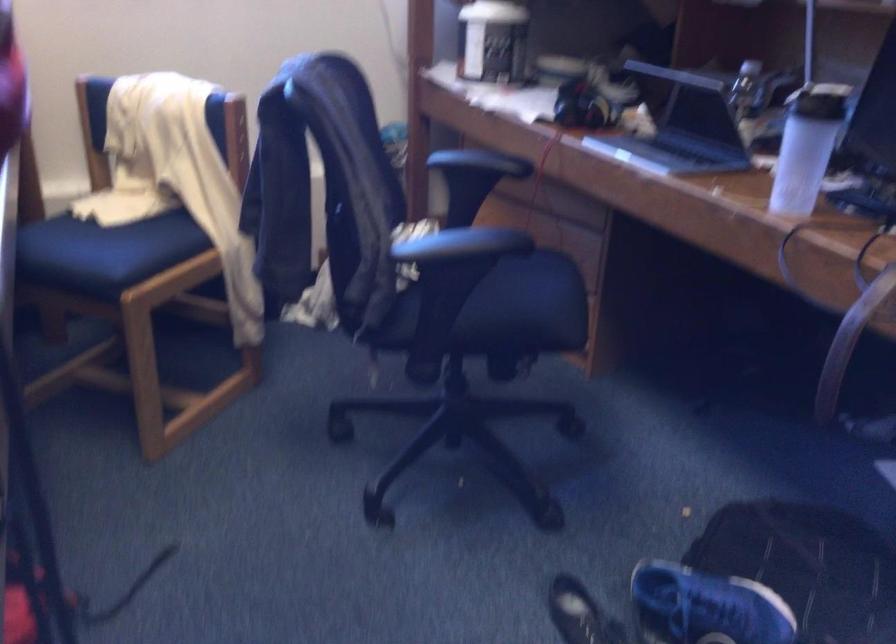
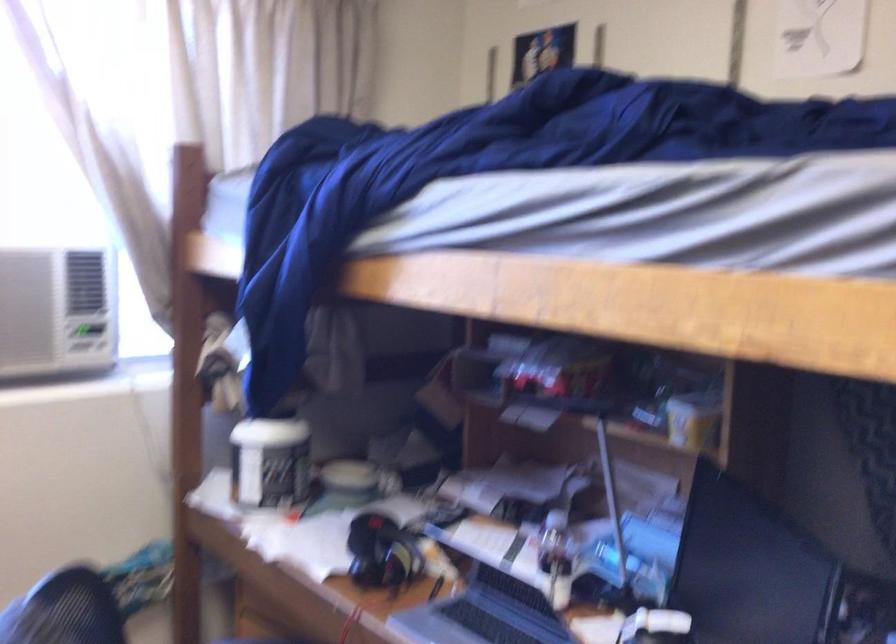
Question: In a continuous first-person perspective shot, in which direction is the camera moving?

Choices:
 (A) Left
 (B) Right
 (C) Forward
 (D) Backward

Answer: (C)